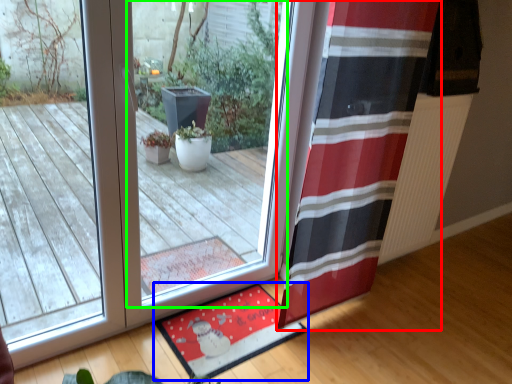
Question: Considering the real-world distances, which object is closest to curtain (highlighted by a red box)? mat (highlighted by a blue box) or window (highlighted by a green box).

Choices:
 (A) mat
 (B) window

Answer: (A)